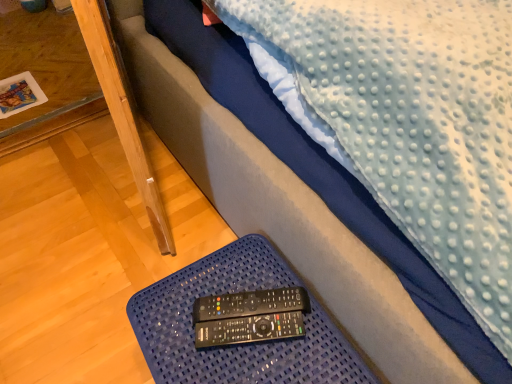
This screenshot has height=384, width=512. I want to click on free space to the left of black plastic remote at lower center, which ranks as the 1th control in back-to-front order, so click(177, 311).